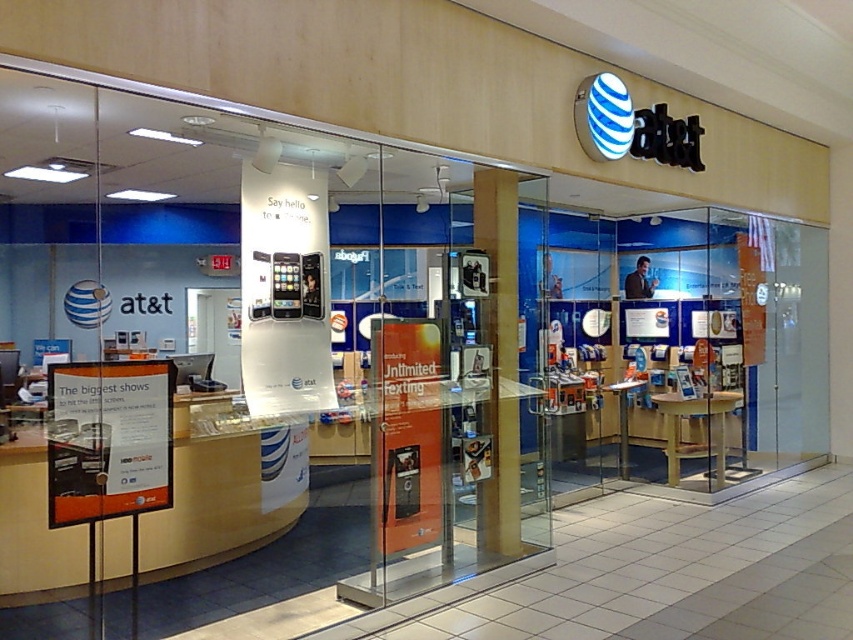
Can you confirm if blue glass display at center is positioned to the left of wooden pillar at center?

In fact, blue glass display at center is to the right of wooden pillar at center.

Identify the location of blue glass display at center. The image size is (853, 640). (691, 353).